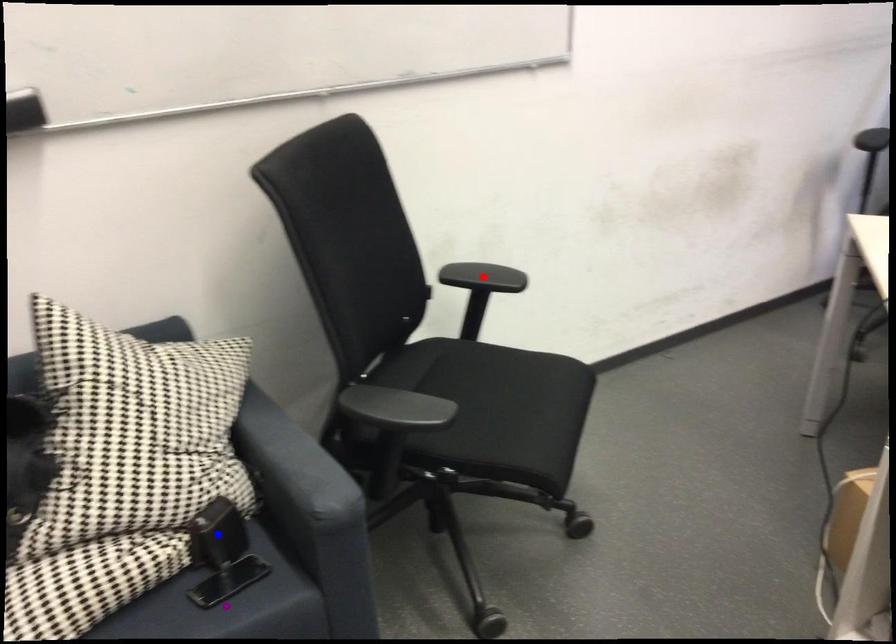
Order these from nearest to farthest:
purple point | blue point | red point

purple point → blue point → red point